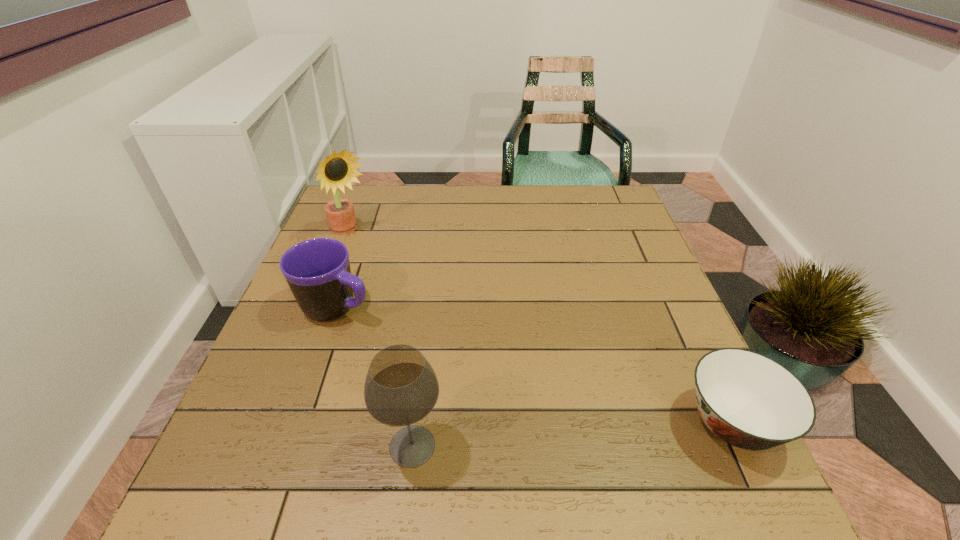
Where is `free space on the desktop that is between the wineglass and the soup bowl and is positioned on the face of the sunflower`? This screenshot has height=540, width=960. free space on the desktop that is between the wineglass and the soup bowl and is positioned on the face of the sunflower is located at coordinates (551, 436).

The height and width of the screenshot is (540, 960). I want to click on free spot on the desktop that is between the second object from right to left and the rightmost object and is positioned with the handle on the side of the third nearest object, so coord(609,432).